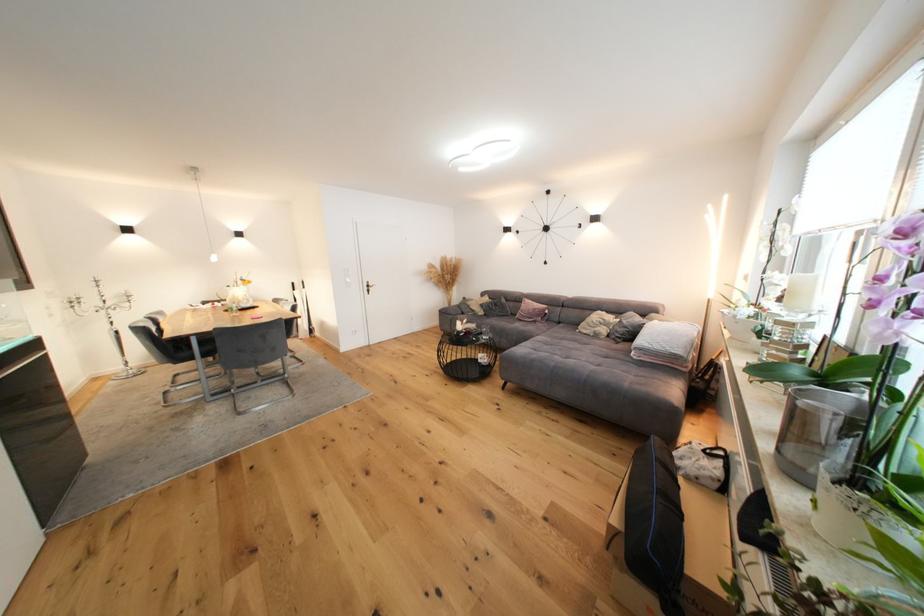
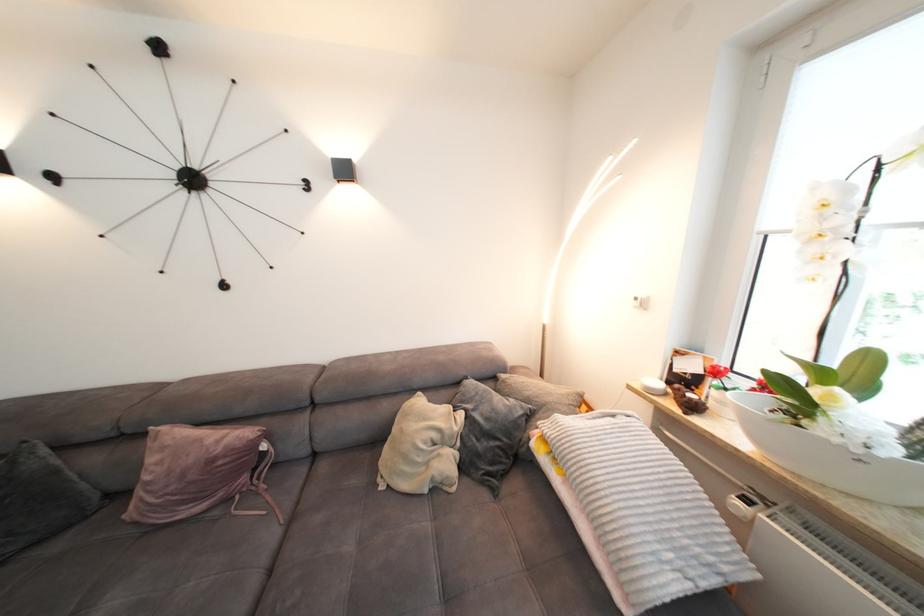
Find the pixel in the second image that matches [612,325] in the first image.

(450, 440)